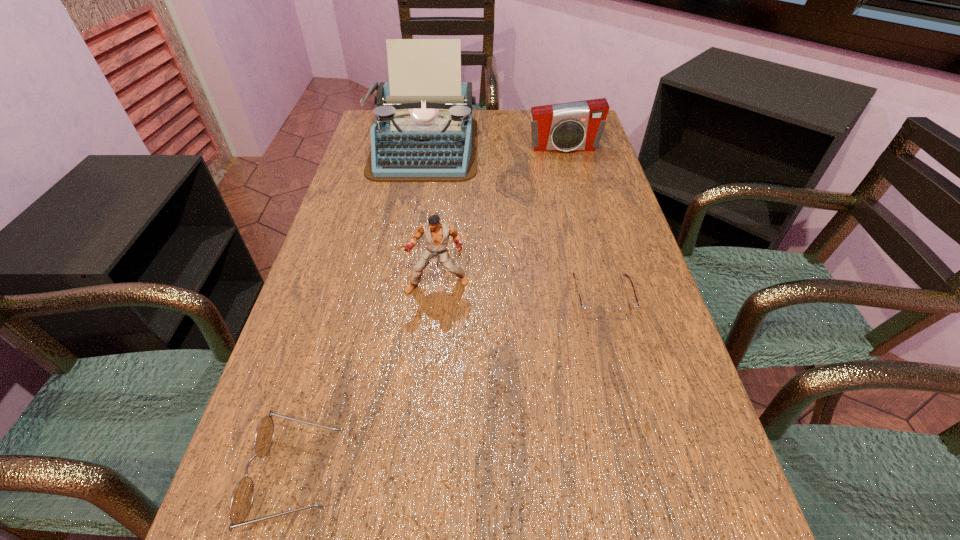
Where is `free region located on the front-facing side of the taller spectacles`? The image size is (960, 540). free region located on the front-facing side of the taller spectacles is located at coordinates (426, 475).

In order to click on free point located on the front-facing side of the shortest object in this screenshot , I will do `click(658, 514)`.

Where is `typewriter at the far edge`? The image size is (960, 540). typewriter at the far edge is located at coordinates (424, 131).

I want to click on camera located at the far edge, so click(574, 126).

The width and height of the screenshot is (960, 540). Identify the location of typewriter present at the left edge. (424, 131).

The image size is (960, 540). What are the coordinates of `spectacles that is at the left edge` in the screenshot? It's located at (242, 498).

In order to click on camera that is at the right edge in this screenshot , I will do `click(574, 126)`.

Find the location of a particular element. spectacles that is at the right edge is located at coordinates (593, 313).

You are a GUI agent. You are given a task and a screenshot of the screen. Output one action in this format:
    pyautogui.click(x=<x>, y=<y>)
    Task: Click on the object that is at the far left corner
    Image resolution: width=960 pixels, height=540 pixels.
    Given the screenshot: What is the action you would take?
    pyautogui.click(x=424, y=131)

Locate an element on the screen. The width and height of the screenshot is (960, 540). object that is at the far right corner is located at coordinates (574, 126).